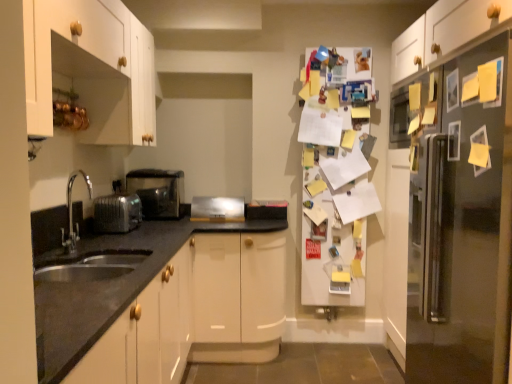
Question: From a real-world perspective, is satin silver toaster at lower left, positioned as the 1th appliance in front-to-back order, physically above satin silver refrigerator at right, the first fridge positioned from the right?

Choices:
 (A) no
 (B) yes

Answer: (B)

Question: Considering the relative sizes of satin silver toaster at lower left, marked as the first appliance in a left-to-right arrangement, and satin silver refrigerator at right, which is counted as the second fridge, starting from the left, in the image provided, is satin silver toaster at lower left, marked as the first appliance in a left-to-right arrangement, wider than satin silver refrigerator at right, which is counted as the second fridge, starting from the left,?

Choices:
 (A) no
 (B) yes

Answer: (A)

Question: From the image's perspective, is satin silver toaster at lower left, which is the 3th appliance from back to front, under satin silver refrigerator at right, which is the 2th fridge from back to front?

Choices:
 (A) no
 (B) yes

Answer: (A)

Question: Is satin silver toaster at lower left, positioned as the 1th appliance in front-to-back order, to the right of satin silver refrigerator at right, the first fridge positioned from the right, from the viewer's perspective?

Choices:
 (A) yes
 (B) no

Answer: (B)

Question: Considering the relative positions of satin silver toaster at lower left, marked as the first appliance in a left-to-right arrangement, and satin silver refrigerator at right, placed as the 1th fridge when sorted from front to back, in the image provided, is satin silver toaster at lower left, marked as the first appliance in a left-to-right arrangement, behind satin silver refrigerator at right, placed as the 1th fridge when sorted from front to back,?

Choices:
 (A) yes
 (B) no

Answer: (A)

Question: Considering the positions of satin silver refrigerator at right, which is the 2th fridge from back to front, and satin silver toaster at lower left, the third appliance when ordered from front to back, in the image, is satin silver refrigerator at right, which is the 2th fridge from back to front, wider or thinner than satin silver toaster at lower left, the third appliance when ordered from front to back,?

Choices:
 (A) thin
 (B) wide

Answer: (B)

Question: Is satin silver refrigerator at right, which is the 2th fridge from back to front, in front of or behind satin silver toaster at lower left, which appears as the second appliance when viewed from the right, in the image?

Choices:
 (A) behind
 (B) front

Answer: (B)

Question: Would you say satin silver refrigerator at right, placed as the 1th fridge when sorted from front to back, is to the left or to the right of satin silver toaster at lower left, which appears as the second appliance when viewed from the left, in the picture?

Choices:
 (A) right
 (B) left

Answer: (A)

Question: In terms of size, does satin silver refrigerator at right, placed as the 1th fridge when sorted from front to back, appear bigger or smaller than satin silver toaster at lower left, which appears as the second appliance when viewed from the right?

Choices:
 (A) small
 (B) big

Answer: (B)

Question: Choose the correct answer: Is satin nickel faucet at lower left inside satin silver toaster at center, which is counted as the second appliance, starting from the front, or outside it?

Choices:
 (A) inside
 (B) outside

Answer: (B)

Question: Based on their sizes in the image, would you say satin nickel faucet at lower left is bigger or smaller than satin silver toaster at center, which ranks as the 2th appliance in back-to-front order?

Choices:
 (A) small
 (B) big

Answer: (B)

Question: From the image's perspective, relative to satin silver toaster at center, which is counted as the second appliance, starting from the front, is satin nickel faucet at lower left above or below?

Choices:
 (A) above
 (B) below

Answer: (A)

Question: Is satin nickel faucet at lower left to the left or to the right of satin silver toaster at center, the 1th appliance from the right, in the image?

Choices:
 (A) right
 (B) left

Answer: (B)

Question: Is white wood cabinet at upper left bigger or smaller than satin nickel faucet at lower left?

Choices:
 (A) big
 (B) small

Answer: (A)

Question: Is white wood cabinet at upper left taller or shorter than satin nickel faucet at lower left?

Choices:
 (A) tall
 (B) short

Answer: (A)